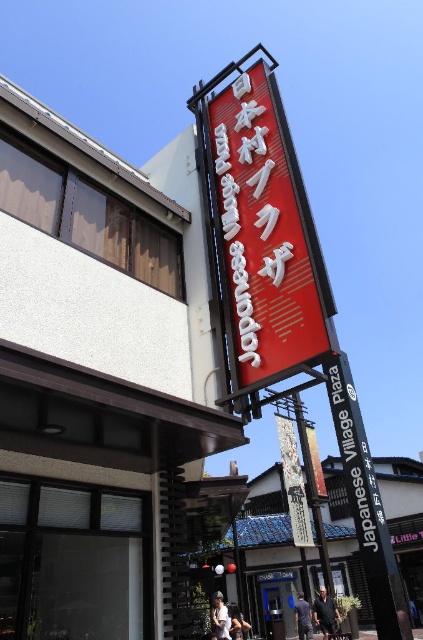
Does point (266, 340) lie behind point (293, 605)?

No, it is in front of (293, 605).

Can you confirm if red matte sign at upper center is shorter than blue fabric shirt at lower center?

Incorrect, red matte sign at upper center's height does not fall short of blue fabric shirt at lower center's.

Is point (301, 260) positioned behind point (302, 630)?

No, it is in front of (302, 630).

Where is `red matte sign at upper center`? red matte sign at upper center is located at coordinates (261, 232).

Between white paper sign at center and dark blue jeans at center, which one is positioned lower?

dark blue jeans at center is lower down.

The height and width of the screenshot is (640, 423). Find the location of `white paper sign at center`. white paper sign at center is located at coordinates (293, 483).

Consider the image. Can you confirm if dark blue jeans at center is smaller than white cotton shirt at lower center?

Actually, dark blue jeans at center might be larger than white cotton shirt at lower center.

Between point (316, 611) and point (230, 620), which one is positioned in front?

Point (230, 620) is more forward.

At what (x,y) coordinates should I click in order to perform the action: click on dark blue jeans at center. Please return your answer as a coordinate pair (x, y). Image resolution: width=423 pixels, height=640 pixels. Looking at the image, I should click on (326, 612).